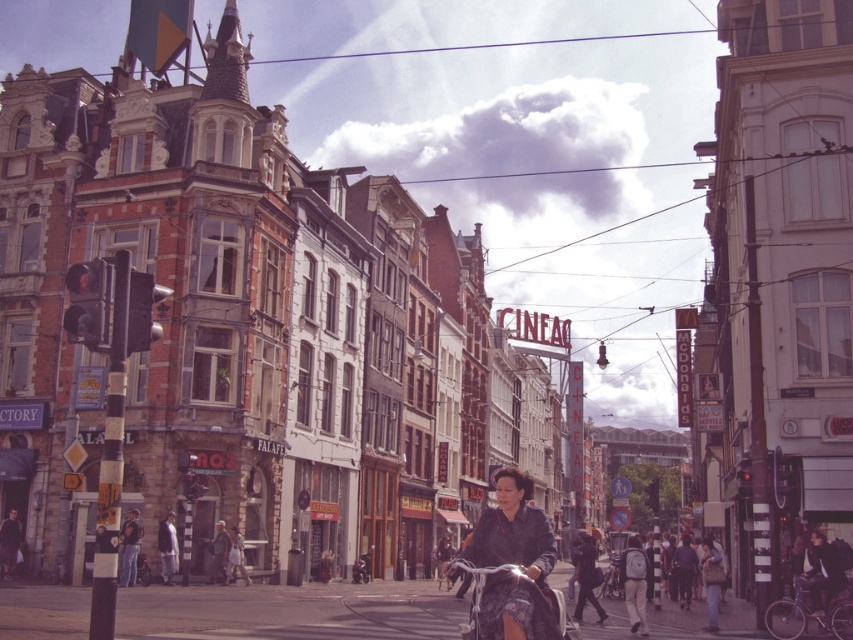
Who is positioned more to the left, shiny metallic bicycle at lower right or dark blue jacket at center?

From the viewer's perspective, dark blue jacket at center appears more on the left side.

Which is behind, point (804, 609) or point (170, 563)?

The point (170, 563) is more distant.

Who is more forward, (775, 620) or (161, 532)?

Point (775, 620) is in front.

Locate an element on the screen. The image size is (853, 640). shiny metallic bicycle at lower right is located at coordinates (810, 611).

Is dark blue fabric jacket at center wider than dark blue jeans at center?

Yes.

Is point (543, 630) farther from viewer compared to point (691, 586)?

No, it is in front of (691, 586).

What do you see at coordinates (514, 563) in the screenshot? I see `dark blue fabric jacket at center` at bounding box center [514, 563].

You are a GUI agent. You are given a task and a screenshot of the screen. Output one action in this format:
    pyautogui.click(x=<x>, y=<y>)
    Task: Click on the dark blue fabric jacket at center
    Image resolution: width=853 pixels, height=640 pixels.
    Given the screenshot: What is the action you would take?
    pyautogui.click(x=514, y=563)

Can you confirm if dark blue jeans at center is shorter than dark blue jacket at center?

Indeed, dark blue jeans at center has a lesser height compared to dark blue jacket at center.

Who is more distant from viewer, (672, 573) or (161, 576)?

The point (672, 573) is more distant.

Who is more distant from viewer, (682,598) or (161,541)?

The point (682,598) is more distant.

Identify the location of dark blue jeans at center. The image size is (853, 640). (683, 570).